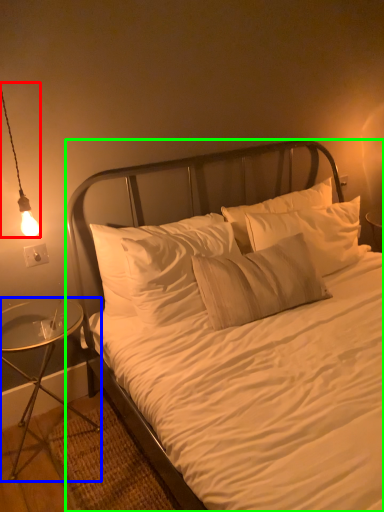
Question: Which object is positioned closest to lamp (highlighted by a red box)? Select from nightstand (highlighted by a blue box) and bed (highlighted by a green box).

Choices:
 (A) nightstand
 (B) bed

Answer: (A)